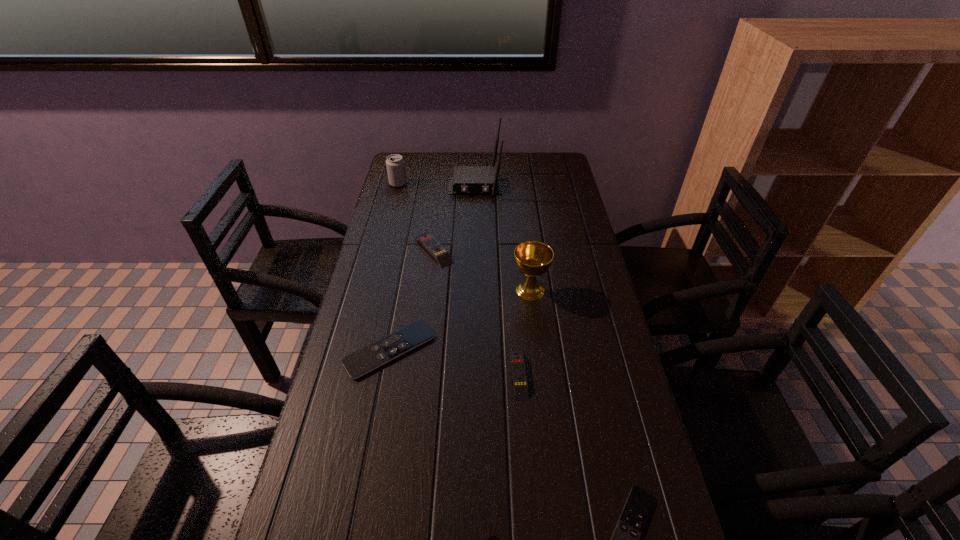
At what (x,y) coordinates should I click in order to perform the action: click on object that is the third closest to the fourth remote control from left to right. Please return your answer as a coordinate pair (x, y). This screenshot has width=960, height=540. Looking at the image, I should click on (625, 539).

Point out which remote control is positioned as the third nearest to the second biggest black remote control. Please provide its 2D coordinates. Your answer should be formatted as a tuple, i.e. [(x, y)], where the tuple contains the x and y coordinates of a point satisfying the conditions above.

[(376, 354)]

Image resolution: width=960 pixels, height=540 pixels. Identify the location of remote control that stands as the third closest to the second remote control from right to left. (493, 539).

Select which black remote control appears as the closest to the rightmost object. Please provide its 2D coordinates. Your answer should be formatted as a tuple, i.e. [(x, y)], where the tuple contains the x and y coordinates of a point satisfying the conditions above.

[(493, 539)]

Identify which black remote control is the nearest to the sixth shortest object. Please provide its 2D coordinates. Your answer should be formatted as a tuple, i.e. [(x, y)], where the tuple contains the x and y coordinates of a point satisfying the conditions above.

[(376, 354)]

You are a GUI agent. You are given a task and a screenshot of the screen. Output one action in this format:
    pyautogui.click(x=<x>, y=<y>)
    Task: Click on the blank space that satisfies the following two spatial constraints: 1. on the front side of the nearer yellow remote control; 2. on the left side of the farthest remote control
    This screenshot has height=540, width=960.
    Given the screenshot: What is the action you would take?
    pyautogui.click(x=419, y=375)